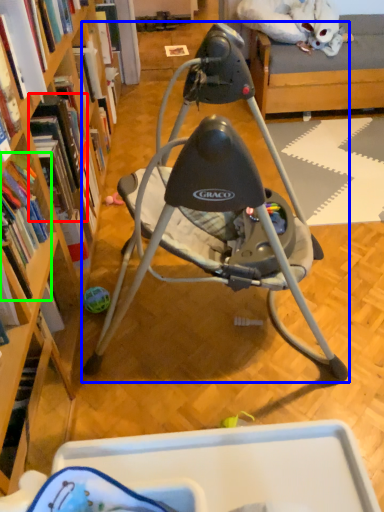
Question: Estimate the real-world distances between objects in this image. Which object is closer to book (highlighted by a red box), chair (highlighted by a blue box) or book (highlighted by a green box)?

Choices:
 (A) chair
 (B) book

Answer: (B)